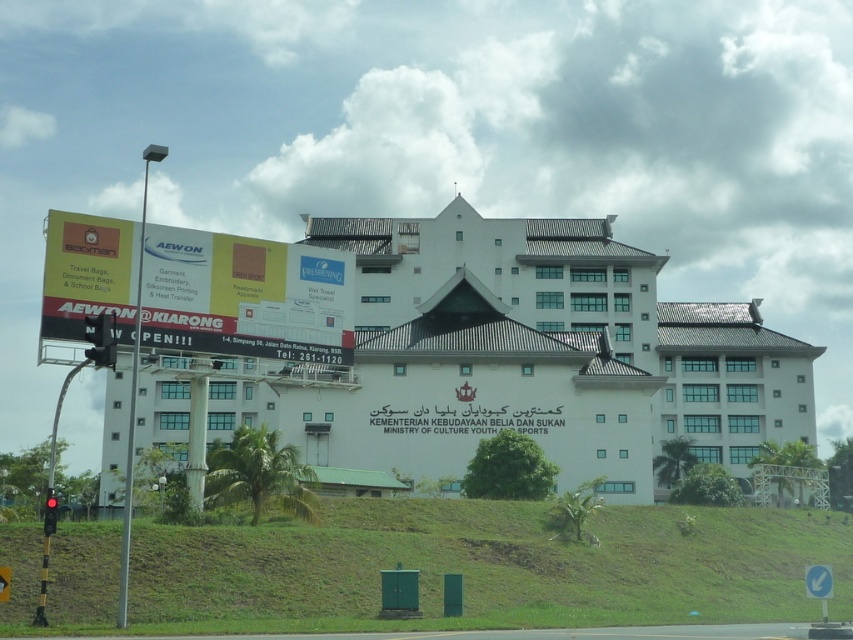
You are standing in front of the Ministry of Culture Youth and Sports building and want to take a photo of the billboard on the left side. Where should you position yourself to include both the green grassy hillside at lower center and the billboard in your shot?

To include both the green grassy hillside at lower center and the billboard in your shot, you should position yourself at point (486, 566), which is where the green grassy hillside at lower center is located according to the coordinates provided.